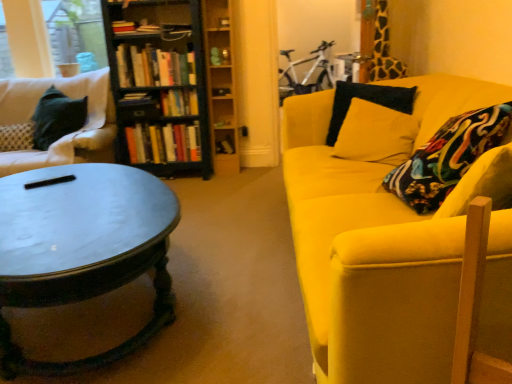
Question: Does white fabric couch at left, which is the first studio couch in back-to-front order, have a lesser height compared to hardcover book at center, which is the first book in bottom-to-top order?

Choices:
 (A) no
 (B) yes

Answer: (A)

Question: Is white fabric couch at left, which is the first studio couch in back-to-front order, completely or partially outside of hardcover book at center, the 6th book when ordered from top to bottom?

Choices:
 (A) no
 (B) yes

Answer: (B)

Question: Is the position of white fabric couch at left, which is the first studio couch in back-to-front order, more distant than that of hardcover book at center, which is the first book in bottom-to-top order?

Choices:
 (A) yes
 (B) no

Answer: (B)

Question: Considering the relative sizes of white fabric couch at left, which is the 2th studio couch in front-to-back order, and hardcover book at center, which is the first book in bottom-to-top order, in the image provided, is white fabric couch at left, which is the 2th studio couch in front-to-back order, wider than hardcover book at center, which is the first book in bottom-to-top order,?

Choices:
 (A) yes
 (B) no

Answer: (A)

Question: Can you confirm if white fabric couch at left, which is the 2th studio couch in front-to-back order, is taller than hardcover book at center, which is the first book in bottom-to-top order?

Choices:
 (A) yes
 (B) no

Answer: (A)

Question: Is white fabric couch at left, which is the second studio couch from right to left, oriented away from hardcover book at center, which is the first book in bottom-to-top order?

Choices:
 (A) no
 (B) yes

Answer: (A)

Question: Is black velvet pillow at upper right positioned before clear glass window screen at upper left?

Choices:
 (A) no
 (B) yes

Answer: (B)

Question: Is black velvet pillow at upper right taller than clear glass window screen at upper left?

Choices:
 (A) yes
 (B) no

Answer: (B)

Question: Considering the relative positions of black velvet pillow at upper right and clear glass window screen at upper left in the image provided, is black velvet pillow at upper right behind clear glass window screen at upper left?

Choices:
 (A) yes
 (B) no

Answer: (B)

Question: Is black velvet pillow at upper right smaller than clear glass window screen at upper left?

Choices:
 (A) no
 (B) yes

Answer: (A)

Question: From the image's perspective, is black velvet pillow at upper right above clear glass window screen at upper left?

Choices:
 (A) no
 (B) yes

Answer: (A)

Question: Is black velvet pillow at upper right positioned far away from clear glass window screen at upper left?

Choices:
 (A) no
 (B) yes

Answer: (B)

Question: From the image's perspective, does white fabric couch at left, which is the 2th studio couch in front-to-back order, appear higher than wooden bookshelf at upper center, the 1th shelf viewed from the top?

Choices:
 (A) no
 (B) yes

Answer: (A)